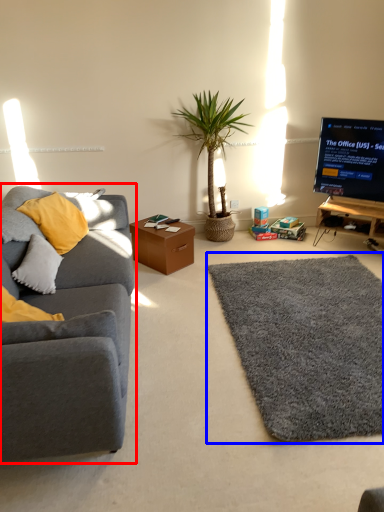
Question: Which object is closer to the camera taking this photo, studio couch (highlighted by a red box) or mat (highlighted by a blue box)?

Choices:
 (A) studio couch
 (B) mat

Answer: (A)